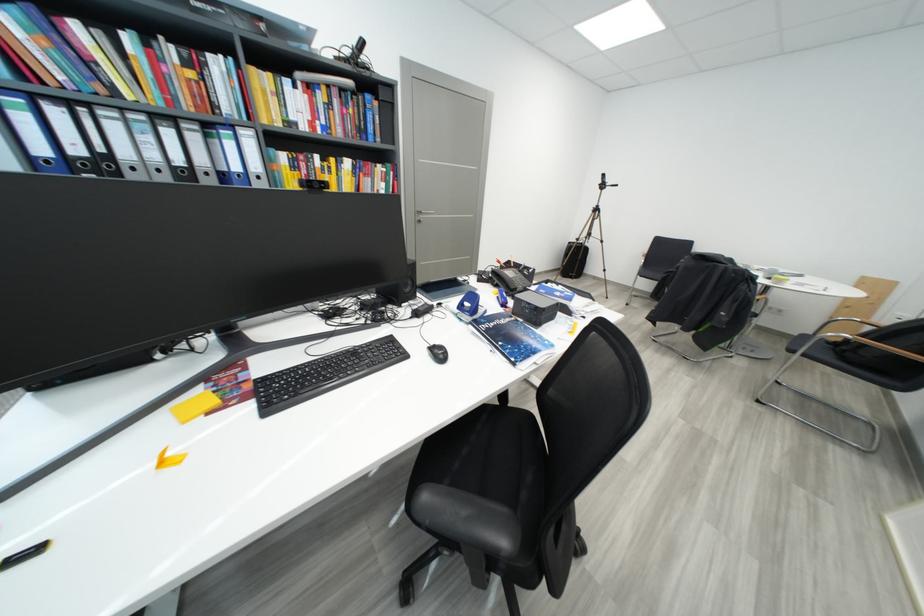
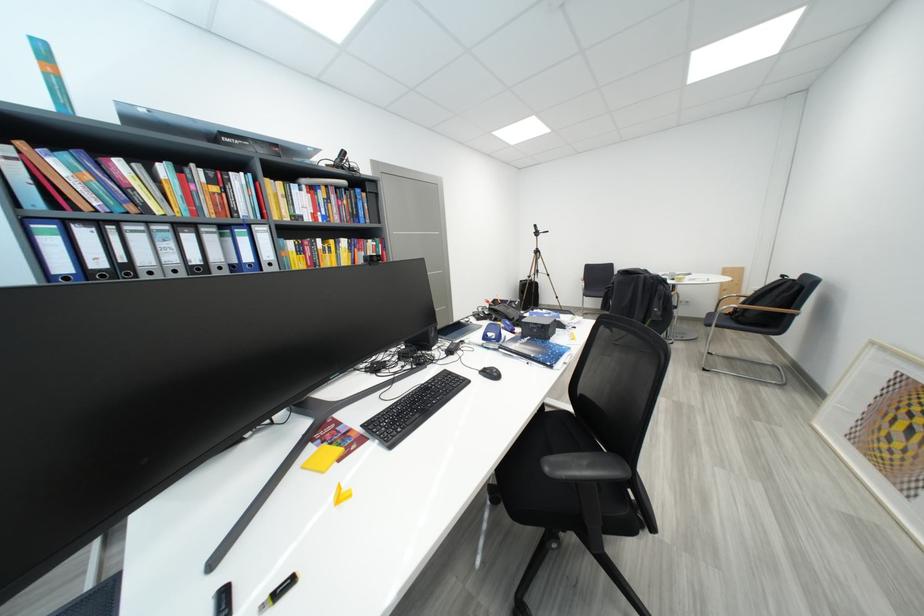
Find the pixel in the second image that matches (244,377) in the first image.

(343, 432)